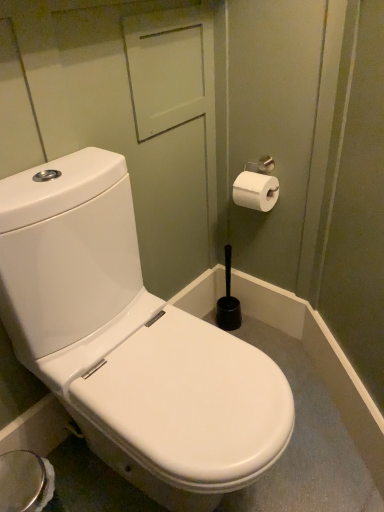
Question: In terms of width, does white matte toilet paper at upper right look wider or thinner when compared to white glossy toilet at center?

Choices:
 (A) thin
 (B) wide

Answer: (A)

Question: From the image's perspective, is white matte toilet paper at upper right positioned above or below white glossy toilet at center?

Choices:
 (A) below
 (B) above

Answer: (B)

Question: Looking at the image, does white matte toilet paper at upper right seem bigger or smaller compared to white glossy toilet at center?

Choices:
 (A) big
 (B) small

Answer: (B)

Question: Is white glossy toilet at center wider or thinner than white matte toilet paper at upper right?

Choices:
 (A) thin
 (B) wide

Answer: (B)

Question: Would you say white glossy toilet at center is inside or outside white matte toilet paper at upper right?

Choices:
 (A) inside
 (B) outside

Answer: (B)

Question: From the image's perspective, is white glossy toilet at center positioned above or below white matte toilet paper at upper right?

Choices:
 (A) above
 (B) below

Answer: (B)

Question: Is white glossy toilet at center bigger or smaller than white matte toilet paper at upper right?

Choices:
 (A) small
 (B) big

Answer: (B)